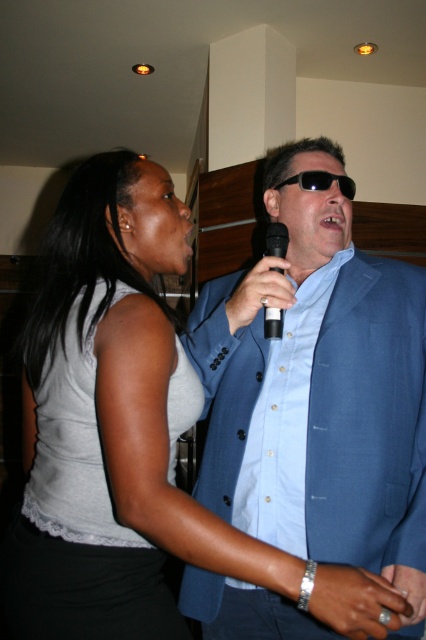
Which is behind, point (264, 312) or point (302, 186)?

The point (302, 186) is behind.

Between black plastic microphone at center and black plastic sunglasses at center, which one appears on the right side from the viewer's perspective?

Positioned to the right is black plastic sunglasses at center.

Find the location of a particular element. The height and width of the screenshot is (640, 426). black plastic microphone at center is located at coordinates (276, 240).

Does gray lace tank top at upper left come in front of black plastic sunglasses at center?

Yes, gray lace tank top at upper left is in front of black plastic sunglasses at center.

Is point (201, 396) more distant than point (354, 180)?

No, (201, 396) is closer to viewer.

Does point (16, 598) lie behind point (331, 180)?

No, it is not.

Identify the location of gray lace tank top at upper left. The height and width of the screenshot is (640, 426). (78, 522).

Describe the element at coordinates (78, 522) in the screenshot. I see `gray lace tank top at upper left` at that location.

Is gray lace tank top at upper left taller than black plastic microphone at center?

Correct, gray lace tank top at upper left is much taller as black plastic microphone at center.

Measure the distance between point [46,611] and camera.

A distance of 36.85 inches exists between point [46,611] and camera.

The image size is (426, 640). I want to click on gray lace tank top at upper left, so click(x=78, y=522).